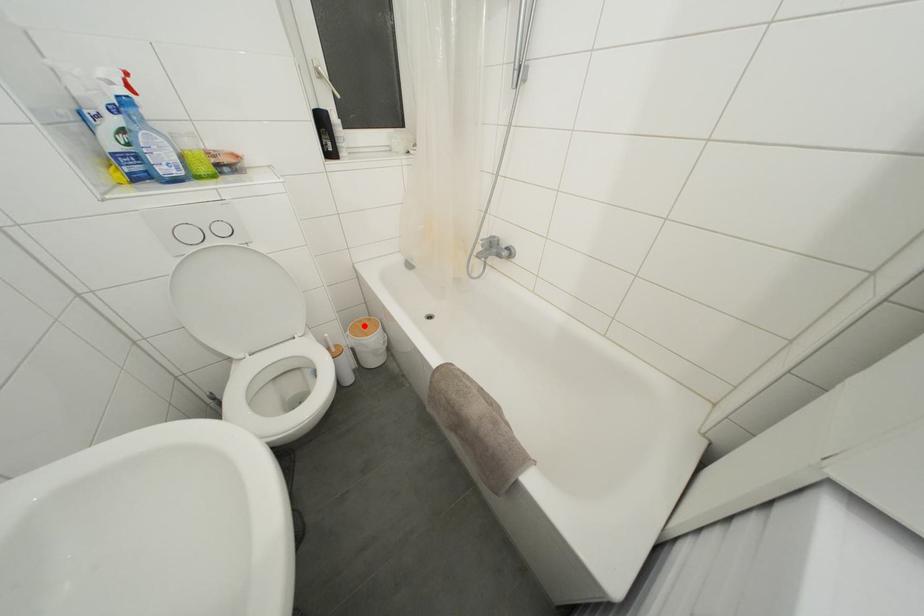
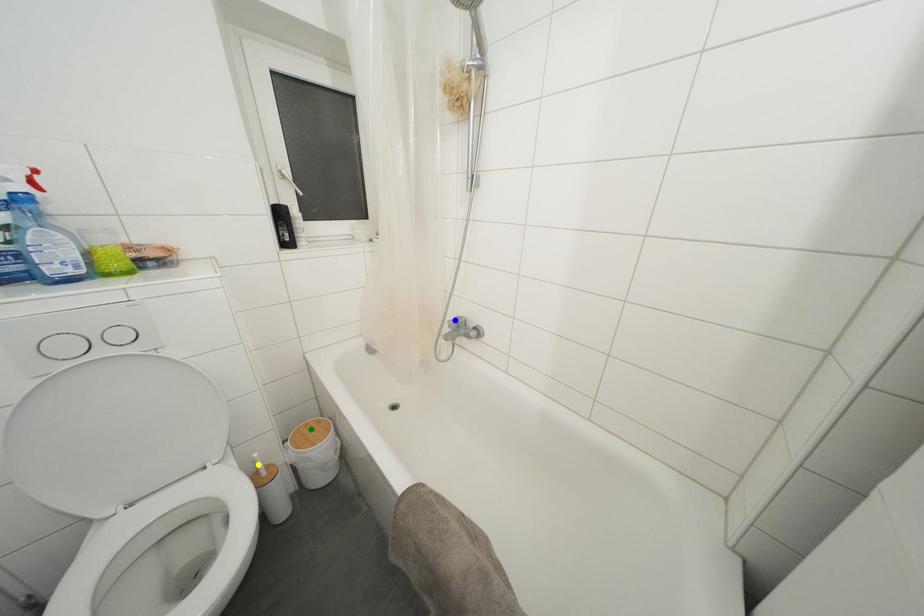
Question: I am providing you with two images of the same scene from different viewpoints. A red point is marked on the first image. You are given multiple points on the second image. In image 2, which mark is for the same physical point as the one in image 1?

Choices:
 (A) yellow point
 (B) green point
 (C) blue point

Answer: (B)